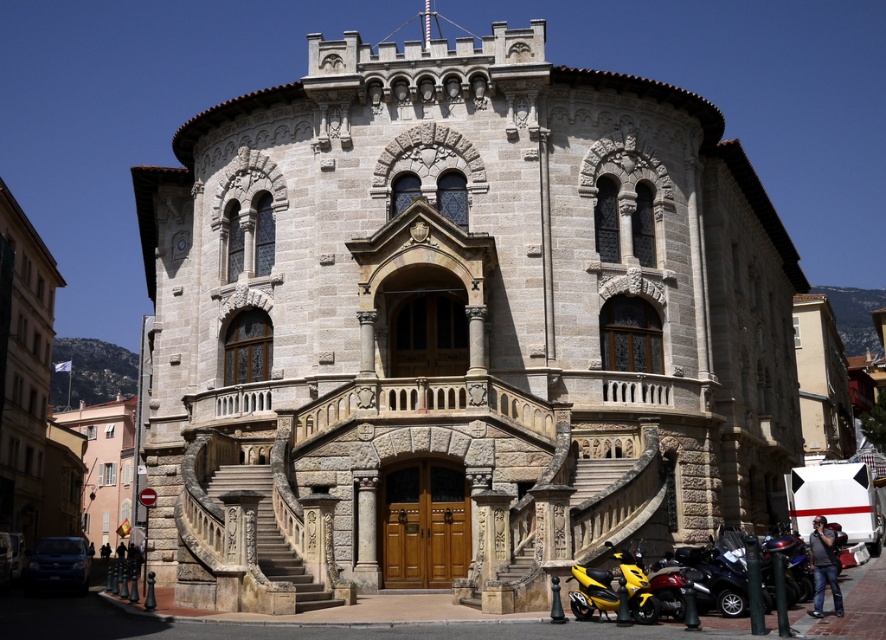
Question: Among these objects, which one is nearest to the camera?

Choices:
 (A) stone textured stairs at center
 (B) yellow matte scooter at lower right

Answer: (B)

Question: Is the position of stone textured church at center more distant than that of stone textured stairs at center?

Choices:
 (A) no
 (B) yes

Answer: (A)

Question: Can you confirm if stone textured church at center is positioned above stone textured stairs at center?

Choices:
 (A) yes
 (B) no

Answer: (A)

Question: Is stone textured church at center further to camera compared to yellow matte scooter at lower right?

Choices:
 (A) yes
 (B) no

Answer: (A)

Question: Among these objects, which one is nearest to the camera?

Choices:
 (A) yellow matte scooter at lower right
 (B) stone textured church at center

Answer: (A)

Question: Among these points, which one is nearest to the camera?

Choices:
 (A) (263, 484)
 (B) (230, 609)
 (C) (641, 618)

Answer: (C)